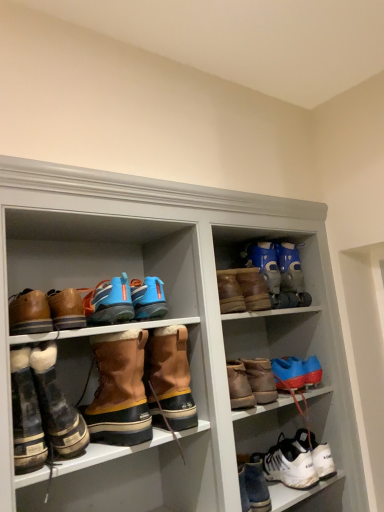
Question: Considering their positions, is blue synthetic running shoes at center, which ranks as the 5th footwear in left-to-right order, located in front of or behind white leather sneakers at lower right, which is the 1th footwear from right to left?

Choices:
 (A) front
 (B) behind

Answer: (A)

Question: Is blue synthetic running shoes at center, which ranks as the 5th footwear in left-to-right order, bigger or smaller than white leather sneakers at lower right, which is the 1th footwear from right to left?

Choices:
 (A) big
 (B) small

Answer: (B)

Question: Which object is positioned farthest from the white fur-lined boots at lower left, the twelfth footwear positioned from the right?

Choices:
 (A) blue matte boot at upper right, the 2th footwear when ordered from right to left
 (B) white leather sneakers at lower right, acting as the fourth footwear starting from the right
 (C) brown suede boots at center, the 8th footwear from the right
 (D) brown suede boots at lower left, the 4th footwear in the left-to-right sequence
 (E) brown suede boots at center, acting as the 7th footwear starting from the left

Answer: (B)

Question: Based on their relative distances, which object is farther from the leather boots at left, which ranks as the 1th footwear in left-to-right order?

Choices:
 (A) brown suede boots at center, the 7th footwear viewed from the right
 (B) blue synthetic ski boots at upper right, the eleventh footwear in the left-to-right sequence
 (C) blue matte boot at upper right, positioned as the twelfth footwear in left-to-right order
 (D) white fur-lined boots at lower left, the twelfth footwear positioned from the right
 (E) brown suede boots at lower left, the 4th footwear in the left-to-right sequence

Answer: (B)